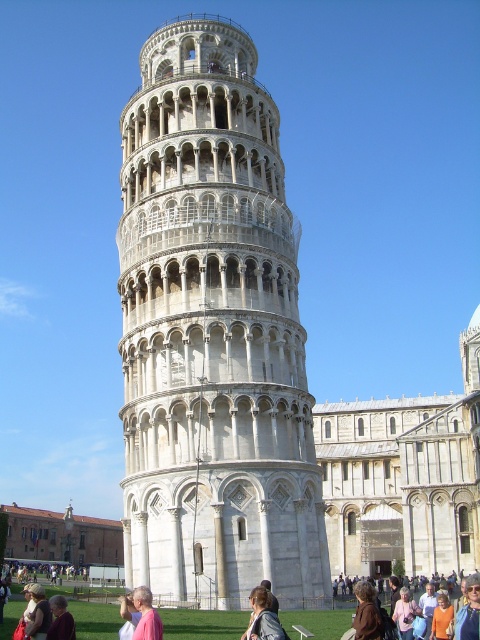
Does white stone tower at center appear on the right side of leather jacket at lower center?

No, white stone tower at center is not to the right of leather jacket at lower center.

Is white stone tower at center above leather jacket at lower center?

Yes.

Who is more distant from viewer, (261, 172) or (269, 612)?

The point (261, 172) is more distant.

The width and height of the screenshot is (480, 640). What are the coordinates of `white stone tower at center` in the screenshot? It's located at (213, 332).

Is point (252, 627) closer to viewer compared to point (58, 624)?

Yes, point (252, 627) is in front of point (58, 624).

Who is lower down, leather jacket at lower center or light brown hair at lower left?

light brown hair at lower left is lower down.

Between point (256, 630) and point (51, 612), which one is positioned behind?

The point (51, 612) is more distant.

Where is `leather jacket at lower center`? The width and height of the screenshot is (480, 640). leather jacket at lower center is located at coordinates (263, 616).

Is white stone tower at center smaller than brown leather jacket at lower center?

No, white stone tower at center is not smaller than brown leather jacket at lower center.

Is white stone tower at center to the right of brown leather jacket at lower center from the viewer's perspective?

No, white stone tower at center is not to the right of brown leather jacket at lower center.

Is point (276, 452) positioned behind point (474, 630)?

Yes.

Identify the location of white stone tower at center. This screenshot has height=640, width=480. (213, 332).